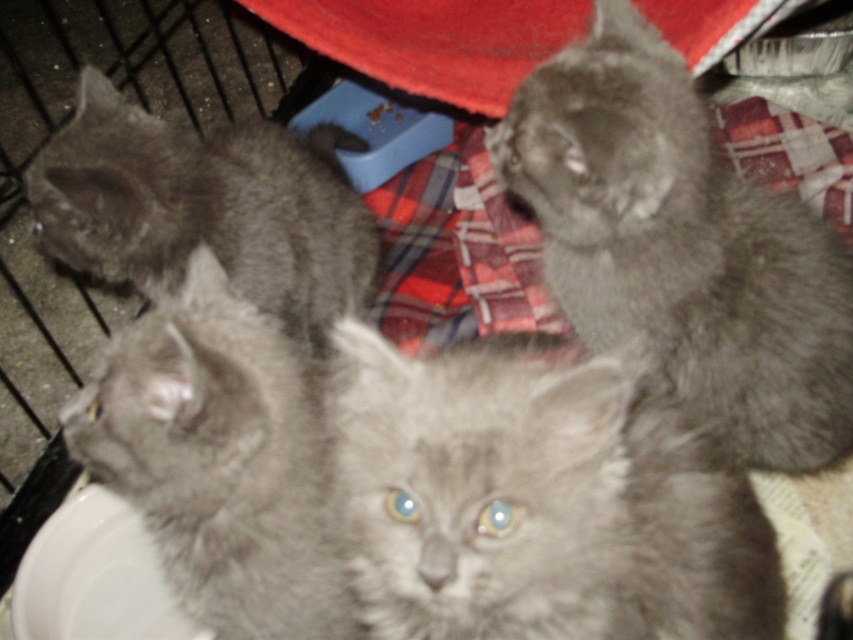
Looking at this image, you are a photographer trying to capture a clear photo of the fluffy gray cat at lower left and the gray fluffy cat at left. Since you want to focus on both cats, which one should you adjust your camera focus on first?

The fluffy gray cat at lower left is in front of the gray fluffy cat at left, so you should focus on the gray fluffy cat at left first to ensure both are in focus.

From the picture: You are a photographer trying to capture a group photo of the fluffy gray cat at upper right and the gray fluffy cat at left. Which cat should you focus on if you want to include both in the frame without cropping either?

You should focus on the gray fluffy cat at left because it occupies more space and will be easier to include both cats in the frame without cropping either.

You are a photographer trying to capture a photo of the fluffy gray cat at upper right and the gray fluffy cat at left. Which cat is positioned lower in the image?

The fluffy gray cat at upper right is positioned lower than the gray fluffy cat at left.